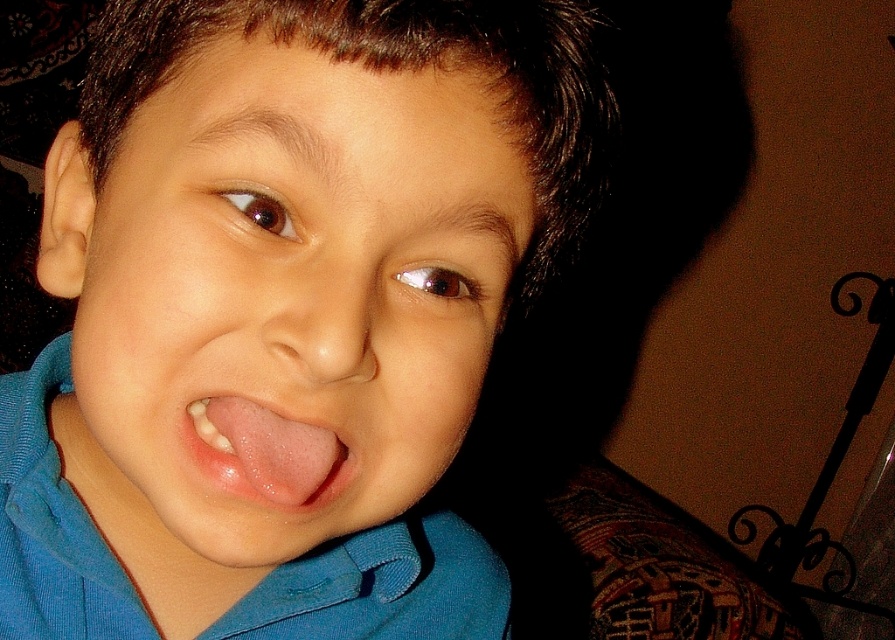
Question: Does blue cotton polo shirt at center appear over pink smooth tongue at center?

Choices:
 (A) yes
 (B) no

Answer: (B)

Question: Is smooth skin face at center above blue cotton polo shirt at center?

Choices:
 (A) yes
 (B) no

Answer: (A)

Question: Which object appears closest to the camera in this image?

Choices:
 (A) blue cotton polo shirt at center
 (B) smooth skin face at center

Answer: (B)

Question: Which of the following is the closest to the observer?

Choices:
 (A) (31, 582)
 (B) (469, 131)

Answer: (B)

Question: Which object is the farthest from the blue cotton polo shirt at center?

Choices:
 (A) smooth skin face at center
 (B) pink smooth tongue at center

Answer: (B)

Question: Is smooth skin face at center to the left of pink smooth tongue at center from the viewer's perspective?

Choices:
 (A) yes
 (B) no

Answer: (A)